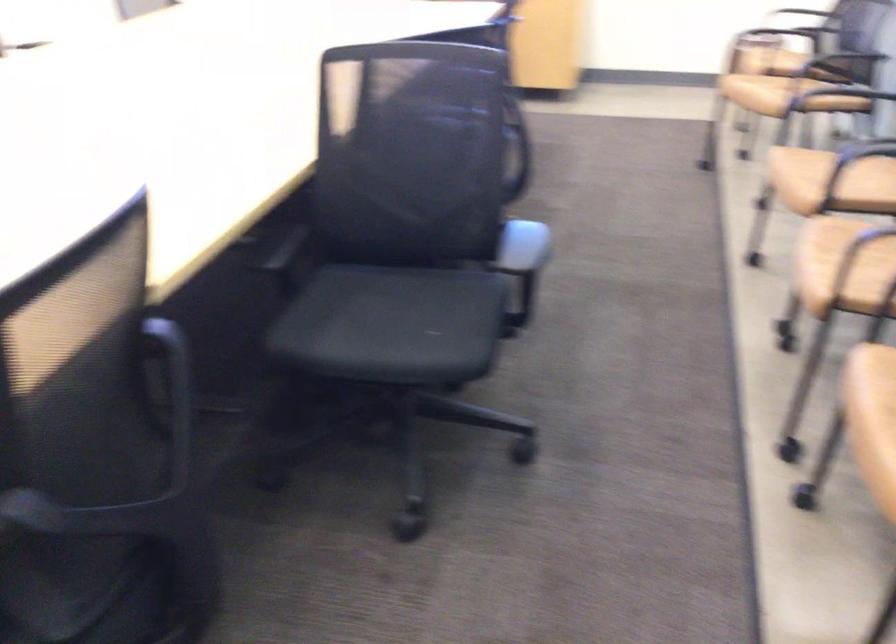
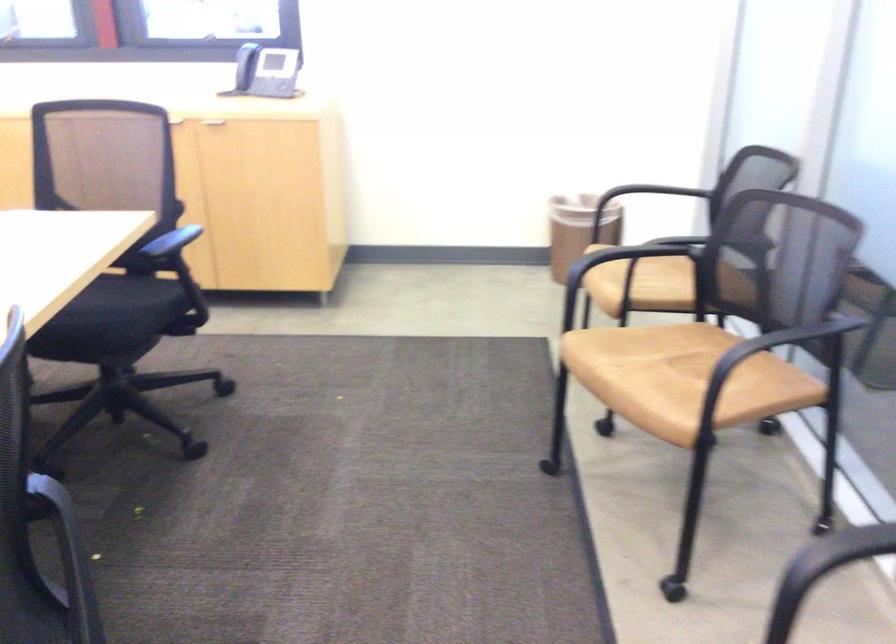
Question: Which direction would the cameraman need to move to produce the second image? Reply with the corresponding letter.

Choices:
 (A) Left
 (B) Right
 (C) Forward
 (D) Backward

Answer: (C)